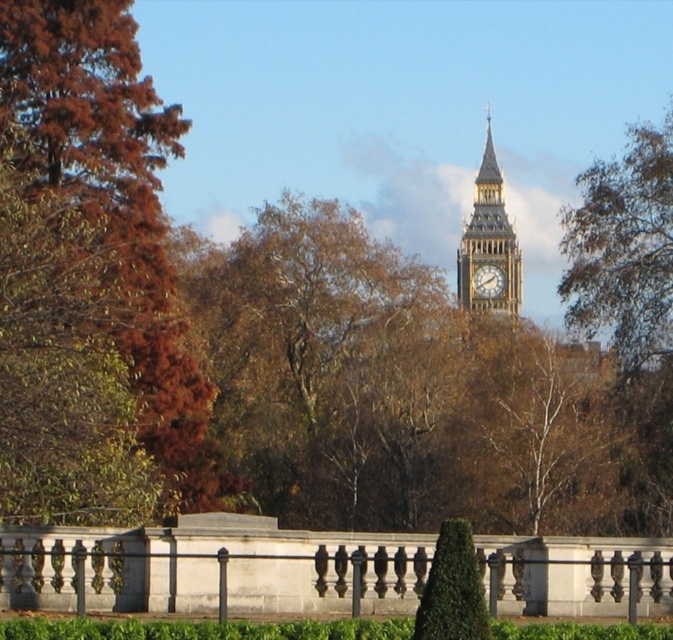
Question: Is brown leafy tree at left behind white stone railing at center?

Choices:
 (A) yes
 (B) no

Answer: (A)

Question: Observing the image, what is the correct spatial positioning of golden stone clock tower at upper center in reference to gold textured clock at center?

Choices:
 (A) left
 (B) right

Answer: (A)

Question: Estimate the real-world distances between objects in this image. Which object is farther from the golden stone clock tower at upper center?

Choices:
 (A) white stone railing at center
 (B) gold textured clock at center
 (C) brown leafy tree at left

Answer: (A)

Question: Based on their relative distances, which object is nearer to the green textured hedge at center?

Choices:
 (A) golden stone clock tower at upper center
 (B) gold textured clock at center
 (C) white stone railing at center
 (D) brown leafy tree at left

Answer: (C)

Question: Which object appears farthest from the camera in this image?

Choices:
 (A) gold textured clock at center
 (B) golden stone clock tower at upper center

Answer: (A)

Question: Can you confirm if brown leafy tree at left is smaller than golden stone clock tower at upper center?

Choices:
 (A) no
 (B) yes

Answer: (A)